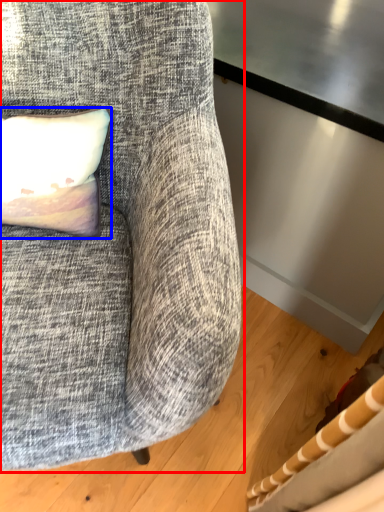
Question: Among these objects, which one is nearest to the camera, chair (highlighted by a red box) or pillow (highlighted by a blue box)?

Choices:
 (A) chair
 (B) pillow

Answer: (A)